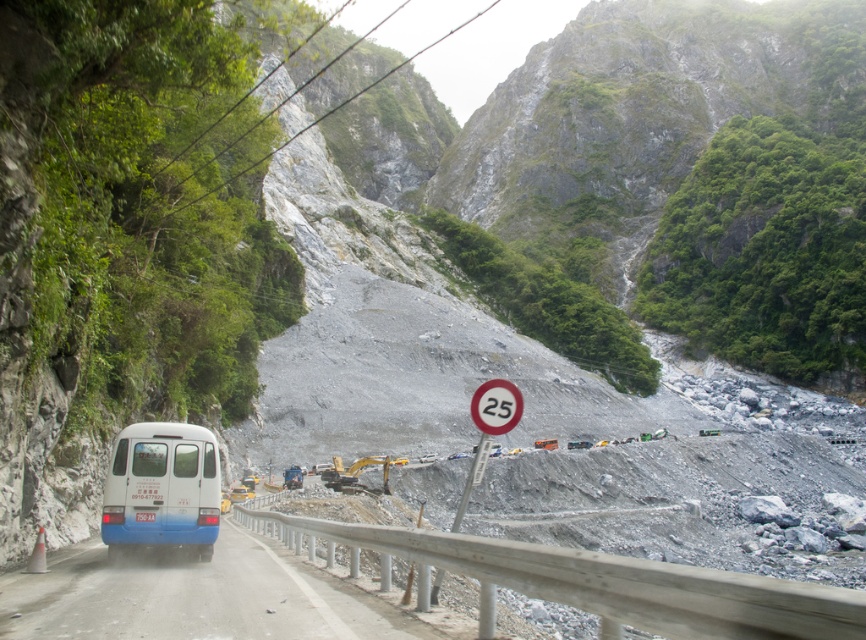
You are a driver of a white and blue bus at left. You need to stop the bus at the guardrail. Is the blue matte bus at left currently positioned to the left of the guardrail?

The blue matte bus at left is positioned at point (162, 486), so yes, it is positioned to the left of the guardrail.

You are a driver of the blue matte bus at left. You see the white plastic speed limit sign at center ahead. The bus can brake safely within 8 meters. Is there a risk of collision if you do not brake?

The distance between the blue matte bus at left and the white plastic speed limit sign at center is 9.09 meters. Since the bus can brake safely within 8 meters, there is a risk of collision if you do not brake.